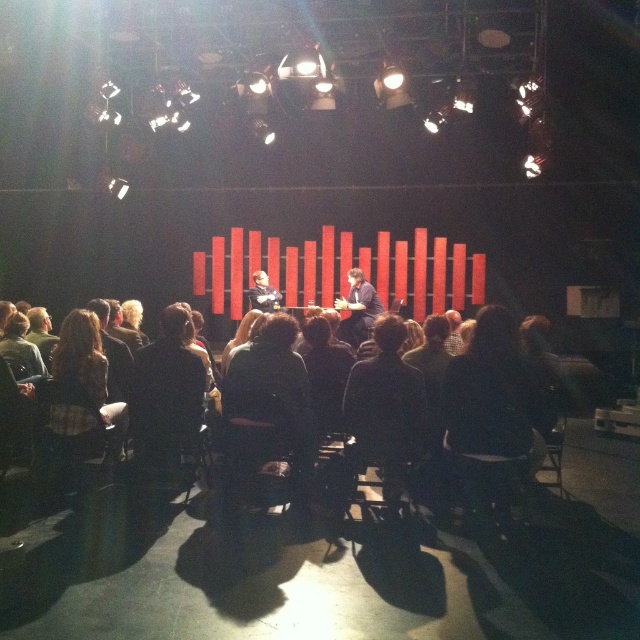
You are an event planner trying to set up a microphone stand for a speaker. The stage has a black fabric chair at lower left. Where would you place the microphone stand so it doesn not block the speaker? Please provide coordinates in the format of x,y where x and y are between 0 and 1.

The black fabric chair at lower left is located at coordinates [170,444]. To avoid blocking the speaker, place the microphone stand slightly to the side or behind the chair, perhaps at coordinates [192,480]. This position keeps it near the speaker while ensuring it doesn not obstruct their view or movement.

You are a photographer standing in the audience of this event. You want to capture a photo that includes both the point at coordinates point (490,349) and point (376,458). Since you want to ensure both points are in focus, you need to know which point is closer to the camera. Can you tell me which one is closer?

Point (490,349) is closer to the camera than point (376,458), so you should focus on that point to ensure both are in focus.

You are an event planner arranging a small discussion panel. You have two chairs to place on the stage for the speakers. The black fabric chair at lower left and the matte black chair at center are available. Which chair should you choose if you need a wider seat for a guest with mobility issues?

The matte black chair at center is wider than the black fabric chair at lower left, so it would be more suitable for a guest with mobility issues requiring a wider seat.